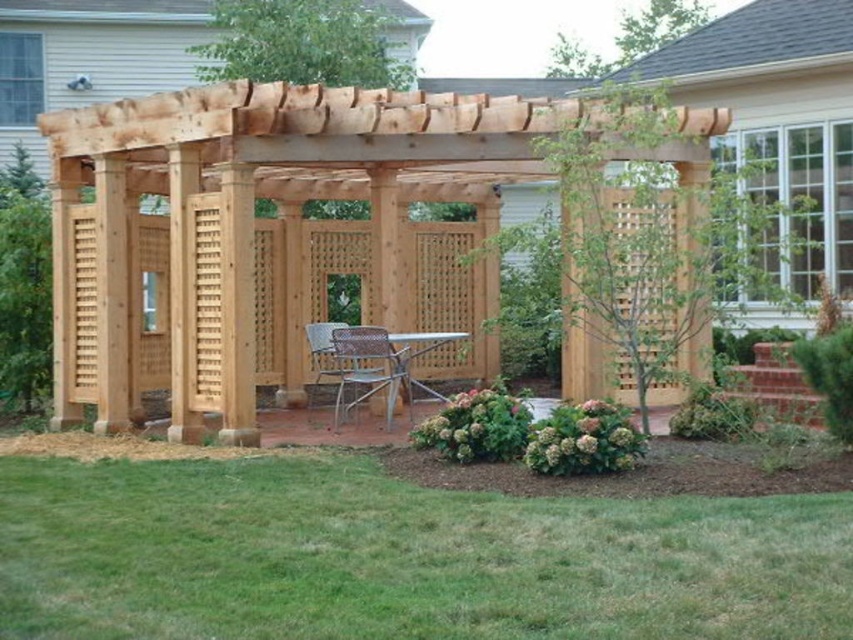
Question: Among these objects, which one is nearest to the camera?

Choices:
 (A) metallic silver chair at center
 (B) natural wood pergola at center

Answer: (A)

Question: Which point appears farthest from the camera in this image?

Choices:
 (A) (379, 346)
 (B) (421, 550)

Answer: (A)

Question: Can you confirm if green grass at lower center is positioned to the left of rattan chair at center?

Choices:
 (A) yes
 (B) no

Answer: (B)

Question: Can you confirm if natural wood pergola at center is thinner than metallic silver chair at center?

Choices:
 (A) yes
 (B) no

Answer: (A)

Question: Which point is farther to the camera?

Choices:
 (A) pos(682,147)
 (B) pos(340,369)

Answer: (B)

Question: Is natural wood pergola at center closer to camera compared to rattan chair at center?

Choices:
 (A) yes
 (B) no

Answer: (B)